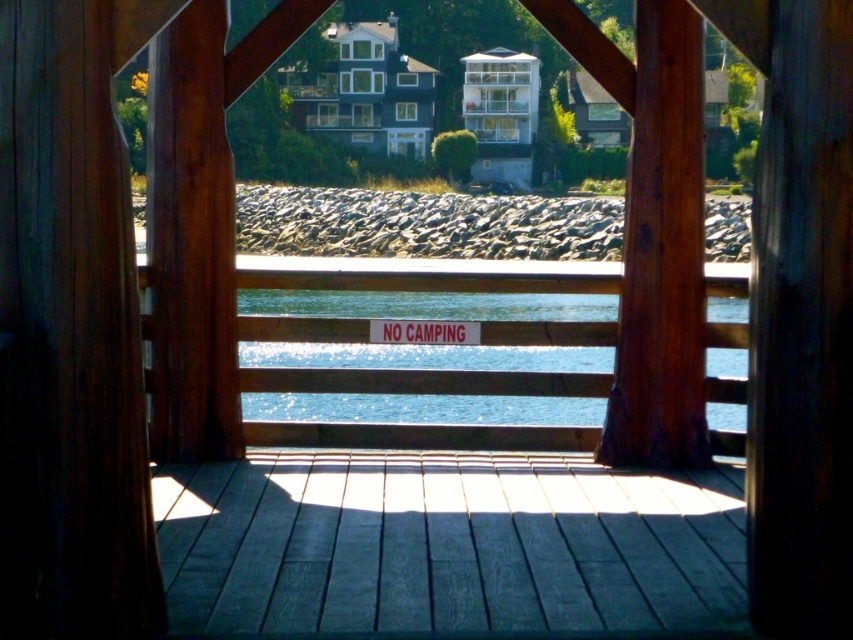
From the picture: Can you confirm if smooth gray wood deck at center is thinner than blue water at center?

Correct, smooth gray wood deck at center's width is less than blue water at center's.

Can you confirm if smooth gray wood deck at center is positioned to the left of blue water at center?

Indeed, smooth gray wood deck at center is positioned on the left side of blue water at center.

Is point (466, 461) closer to viewer compared to point (302, 296)?

Yes, point (466, 461) is in front of point (302, 296).

At what (x,y) coordinates should I click in order to perform the action: click on smooth gray wood deck at center. Please return your answer as a coordinate pair (x, y). The height and width of the screenshot is (640, 853). Looking at the image, I should click on (447, 547).

Can you confirm if blue water at center is taller than white plastic sign at center?

Correct, blue water at center is much taller as white plastic sign at center.

Can you confirm if blue water at center is shorter than white plastic sign at center?

No, blue water at center is not shorter than white plastic sign at center.

At what (x,y) coordinates should I click in order to perform the action: click on blue water at center. Please return your answer as a coordinate pair (x, y). The height and width of the screenshot is (640, 853). Looking at the image, I should click on (424, 408).

Where is `blue water at center`? blue water at center is located at coordinates (424, 408).

Is point (538, 593) farther from viewer compared to point (642, 36)?

No.

Between smooth gray wood deck at center and brown wood at center, which one appears on the right side from the viewer's perspective?

From the viewer's perspective, brown wood at center appears more on the right side.

Which is behind, point (489, 504) or point (643, 205)?

Point (643, 205)

This screenshot has height=640, width=853. I want to click on smooth gray wood deck at center, so click(x=447, y=547).